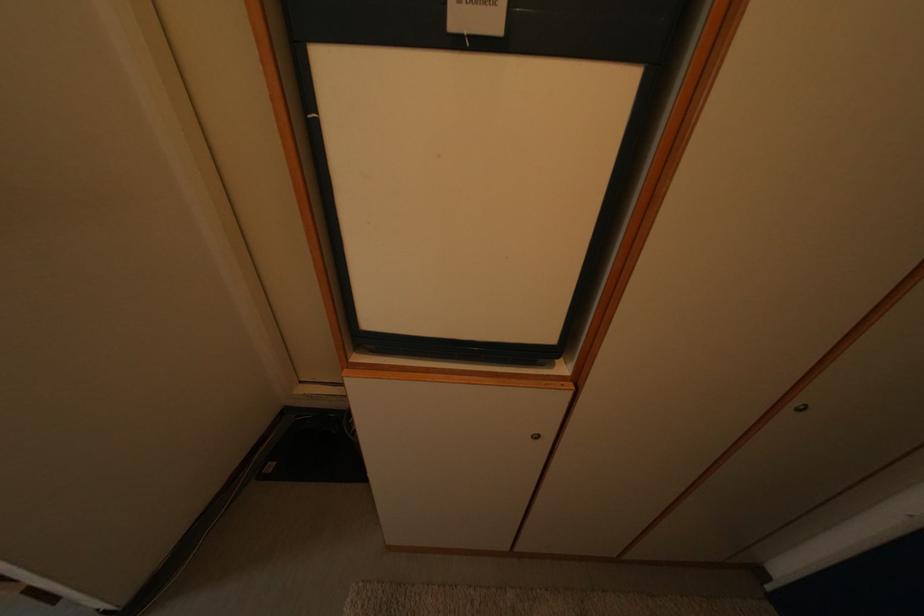
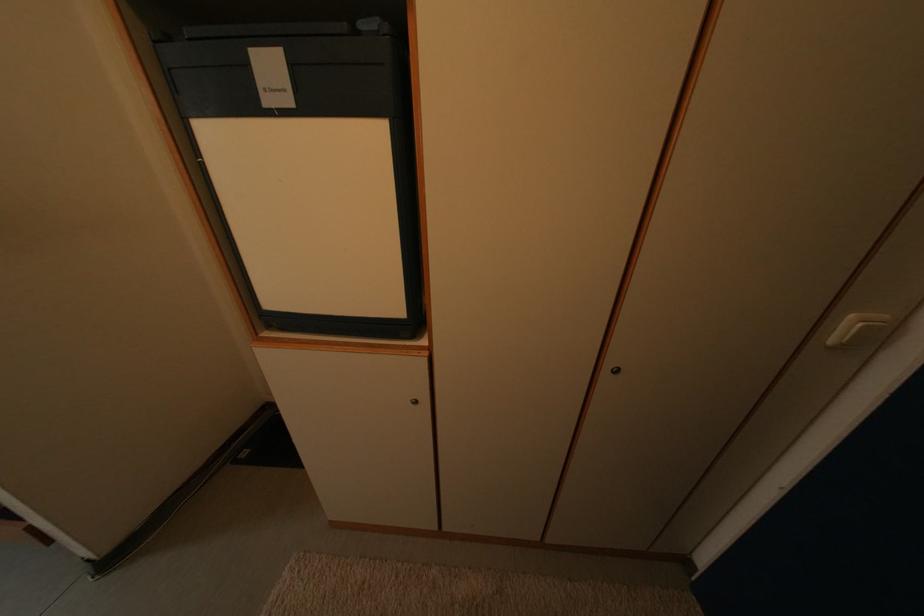
Question: The images are taken continuously from a first-person perspective. In which direction is your viewpoint rotating?

Choices:
 (A) Left
 (B) Right
 (C) Up
 (D) Down

Answer: (C)